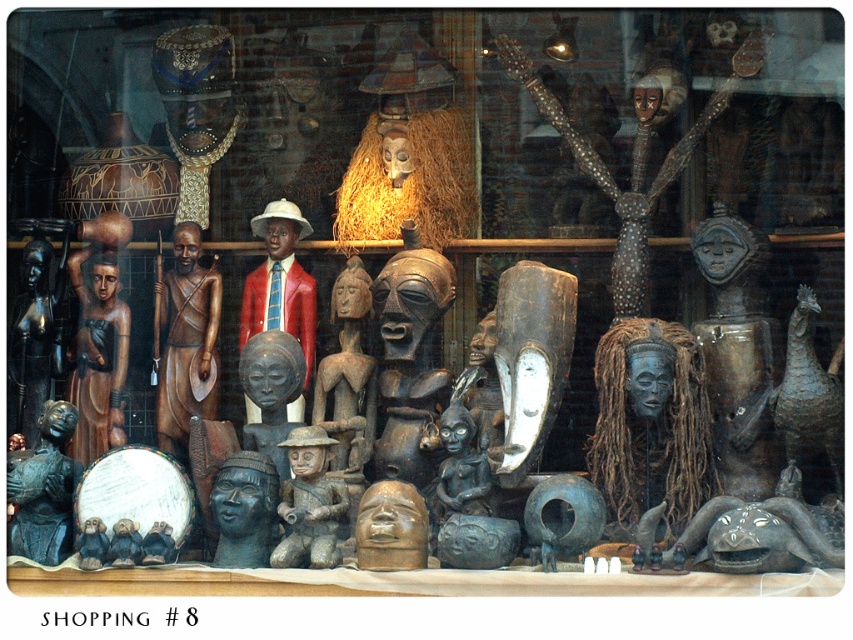
Question: Is wooden mask at center to the right of brown wood figure at center from the viewer's perspective?

Choices:
 (A) no
 (B) yes

Answer: (B)

Question: Does wooden mask at center appear under brown wood figure at center?

Choices:
 (A) yes
 (B) no

Answer: (B)

Question: Which point is farther from the camera taking this photo?

Choices:
 (A) (354, 312)
 (B) (520, 61)

Answer: (A)

Question: Considering the relative positions of wooden mask at center and brown wood figure at center in the image provided, where is wooden mask at center located with respect to brown wood figure at center?

Choices:
 (A) right
 (B) left

Answer: (A)